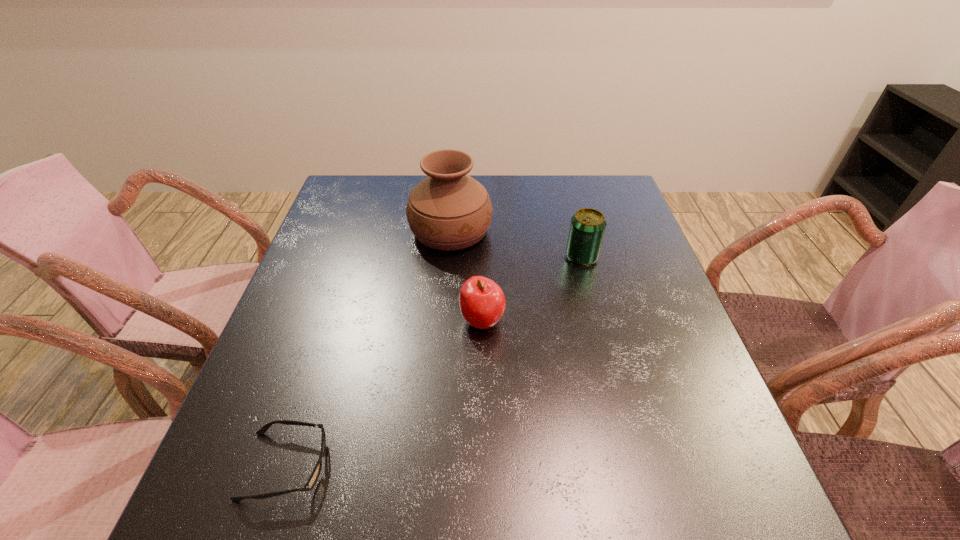
Locate an element on the screen. Image resolution: width=960 pixels, height=540 pixels. object present at the near edge is located at coordinates (314, 476).

What are the coordinates of `object situated at the left edge` in the screenshot? It's located at (314, 476).

Locate an element on the screen. object at the right edge is located at coordinates (587, 228).

Where is `object that is positioned at the near left corner`? This screenshot has height=540, width=960. object that is positioned at the near left corner is located at coordinates (314, 476).

Where is `vacant space at the far edge`? The height and width of the screenshot is (540, 960). vacant space at the far edge is located at coordinates (575, 210).

At what (x,y) coordinates should I click in order to perform the action: click on vacant area at the near edge. Please return your answer as a coordinate pair (x, y). The image size is (960, 540). Looking at the image, I should click on (408, 497).

At what (x,y) coordinates should I click in order to perform the action: click on vacant space at the left edge. Please return your answer as a coordinate pair (x, y). Image resolution: width=960 pixels, height=540 pixels. Looking at the image, I should click on (327, 229).

You are a GUI agent. You are given a task and a screenshot of the screen. Output one action in this format:
    pyautogui.click(x=<x>, y=<y>)
    Task: Click on the vacant space at the right edge of the desktop
    The height and width of the screenshot is (540, 960).
    Given the screenshot: What is the action you would take?
    pyautogui.click(x=637, y=234)

Image resolution: width=960 pixels, height=540 pixels. Find the location of `vacant space at the far left corner of the desktop`. vacant space at the far left corner of the desktop is located at coordinates (376, 177).

At what (x,y) coordinates should I click in order to perform the action: click on vacant space at the far right corner. Please return your answer as a coordinate pair (x, y). The image size is (960, 540). Looking at the image, I should click on (585, 180).